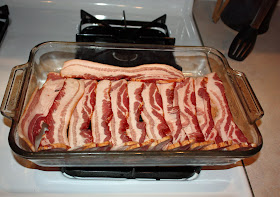
Identify the location of burner. This screenshot has height=197, width=280. (124, 59).